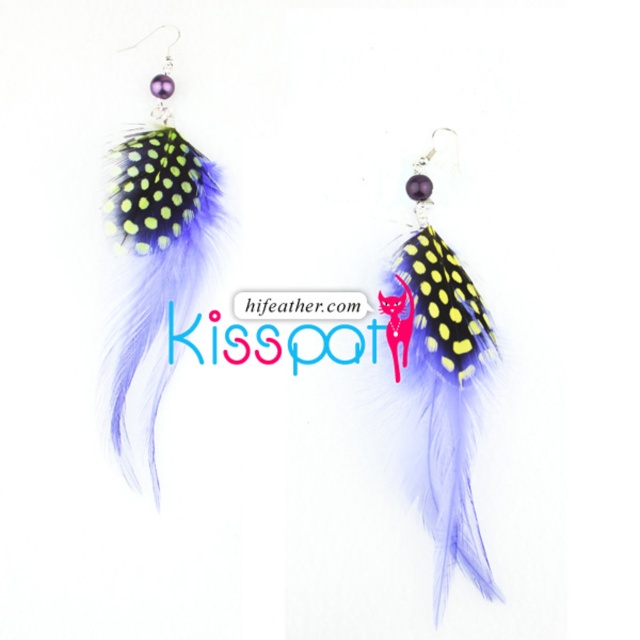
You are a jewelry designer trying to create a matching necklace for the lavender feather earrings at center and the matte black feather at left. Which feather should you base the necklace design on to ensure it complements the width of the earrings?

The lavender feather earrings at center might be wider than matte black feather at left, so you should base the necklace design on the lavender feather earrings at center to ensure it complements the width of the earrings.

You are a jewelry designer who wants to create a matching necklace. You have the lavender feather earrings at center and the matte black feather at left. Which feather should you use to ensure the necklace complements the size of the earrings?

The lavender feather earrings at center is bigger than the matte black feather at left, so you should use the lavender feather earrings at center to ensure the necklace complements the size of the earrings.

Consider the image. You are a customer in a jewelry store looking at the lavender feather earrings at center and the matte black feather at left. Which one is positioned more to the right side of the display?

The lavender feather earrings at center is positioned more to the right side of the display than the matte black feather at left.